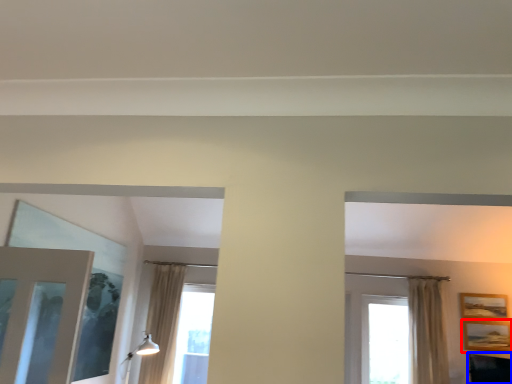
Question: Which point is further to the camera, picture frame (highlighted by a red box) or furniture (highlighted by a blue box)?

Choices:
 (A) picture frame
 (B) furniture

Answer: (A)